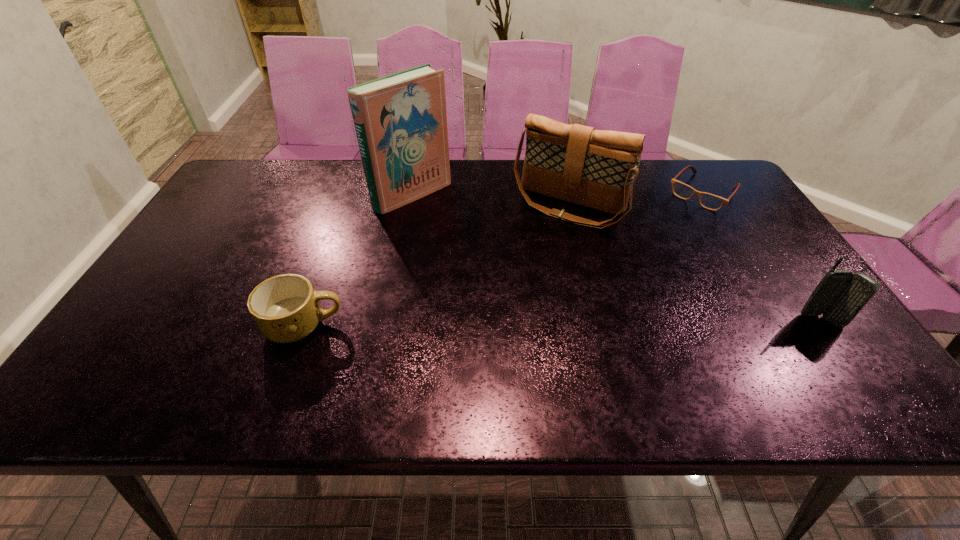
At what (x,y) coordinates should I click in order to perform the action: click on free point located on the front-facing side of the shoulder bag. Please return your answer as a coordinate pair (x, y). Looking at the image, I should click on (538, 245).

Locate an element on the screen. This screenshot has height=540, width=960. free spot located 0.340m on the cover of the hardback book is located at coordinates (514, 269).

Find the location of a particular element. vacant space positioned 0.210m on the cover of the hardback book is located at coordinates (481, 244).

This screenshot has width=960, height=540. I want to click on blank space located on the cover of the hardback book, so click(469, 235).

Identify the location of free space located on the front-facing side of the shortest object. (655, 245).

Where is `vacant position located on the front-facing side of the shortest object`? vacant position located on the front-facing side of the shortest object is located at coordinates (653, 246).

Find the location of a particular element. Image resolution: width=960 pixels, height=540 pixels. free spot located 0.380m on the front-facing side of the shortest object is located at coordinates (627, 275).

Where is `shoulder bag at the far edge`? shoulder bag at the far edge is located at coordinates (575, 163).

The height and width of the screenshot is (540, 960). Find the location of `hardback book that is at the far edge`. hardback book that is at the far edge is located at coordinates [x=400, y=120].

The height and width of the screenshot is (540, 960). What are the coordinates of `spectacles positioned at the far edge` in the screenshot? It's located at (709, 201).